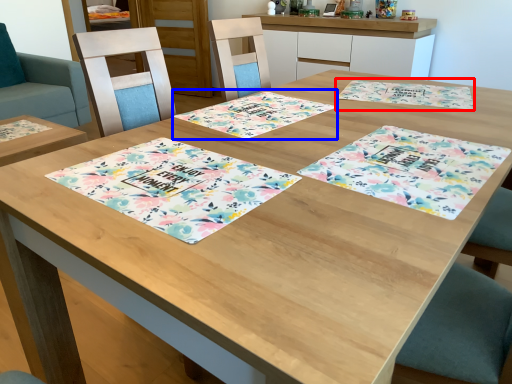
Question: Among these objects, which one is farthest to the camera, place mat (highlighted by a red box) or place mat (highlighted by a blue box)?

Choices:
 (A) place mat
 (B) place mat

Answer: (A)